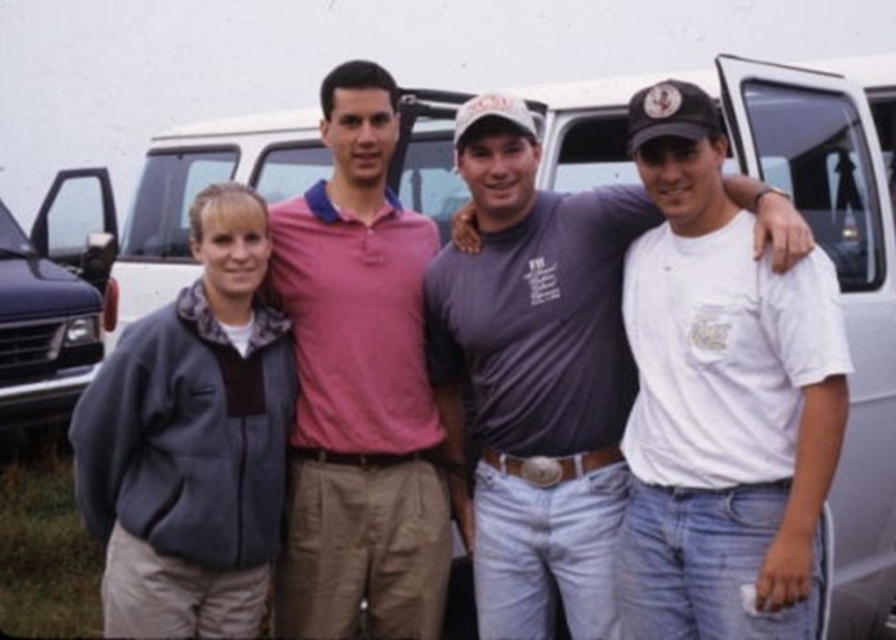
Can you confirm if white cotton t-shirt at center is positioned below matte black van at left?

Yes.

Who is shorter, white cotton t-shirt at center or matte black van at left?

Standing shorter between the two is matte black van at left.

Between point (652, 122) and point (72, 326), which one is positioned in front?

Positioned in front is point (652, 122).

Where is `white cotton t-shirt at center`? white cotton t-shirt at center is located at coordinates (721, 400).

Is white cotton t-shirt at center closer to the viewer compared to pink cotton polo shirt at center?

Yes, white cotton t-shirt at center is closer to the viewer.

Can you confirm if white cotton t-shirt at center is positioned to the right of pink cotton polo shirt at center?

Indeed, white cotton t-shirt at center is positioned on the right side of pink cotton polo shirt at center.

What do you see at coordinates (721, 400) in the screenshot? The height and width of the screenshot is (640, 896). I see `white cotton t-shirt at center` at bounding box center [721, 400].

You are a GUI agent. You are given a task and a screenshot of the screen. Output one action in this format:
    pyautogui.click(x=<x>, y=<y>)
    Task: Click on the white cotton t-shirt at center
    This screenshot has height=640, width=896.
    Given the screenshot: What is the action you would take?
    pyautogui.click(x=721, y=400)

Can you confirm if gray cotton t-shirt at center is shorter than white matte minivan at center?

In fact, gray cotton t-shirt at center may be taller than white matte minivan at center.

What do you see at coordinates (533, 376) in the screenshot? I see `gray cotton t-shirt at center` at bounding box center [533, 376].

Does point (441, 252) come farther from viewer compared to point (287, 196)?

No.

Identify the location of gray cotton t-shirt at center. The width and height of the screenshot is (896, 640). (533, 376).